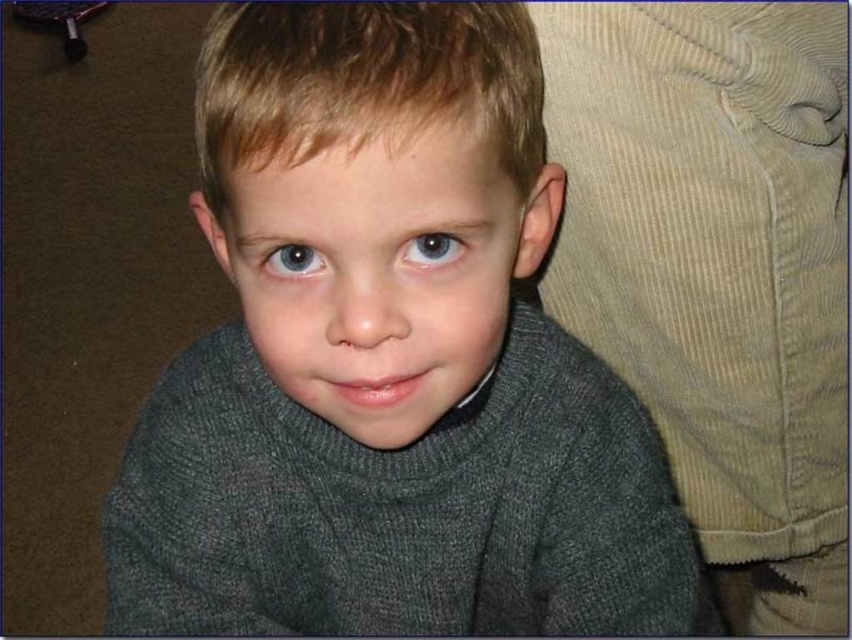
Is dark gray sweater at center bigger than blue glossy eye at center?

Yes.

Who is lower down, dark gray sweater at center or blue glossy eye at center?

Positioned lower is dark gray sweater at center.

Does point (381, 595) come in front of point (419, 257)?

No, it is not.

Where is `dark gray sweater at center`? This screenshot has width=852, height=640. dark gray sweater at center is located at coordinates (389, 362).

Is dark gray sweater at center further to camera compared to corduroy fabric at right?

No, it is in front of corduroy fabric at right.

Which is more to the right, dark gray sweater at center or corduroy fabric at right?

corduroy fabric at right is more to the right.

Who is more distant from viewer, (568,600) or (779,484)?

Positioned behind is point (779,484).

Identify the location of dark gray sweater at center. The width and height of the screenshot is (852, 640). (389, 362).

Between dark gray sweater at center and matte gray sweater at center, which one is positioned higher?

matte gray sweater at center is higher up.

Is dark gray sweater at center wider than matte gray sweater at center?

Indeed, dark gray sweater at center has a greater width compared to matte gray sweater at center.

Is point (151, 596) positioned before point (488, 324)?

That is False.

Identify the location of dark gray sweater at center. (389, 362).